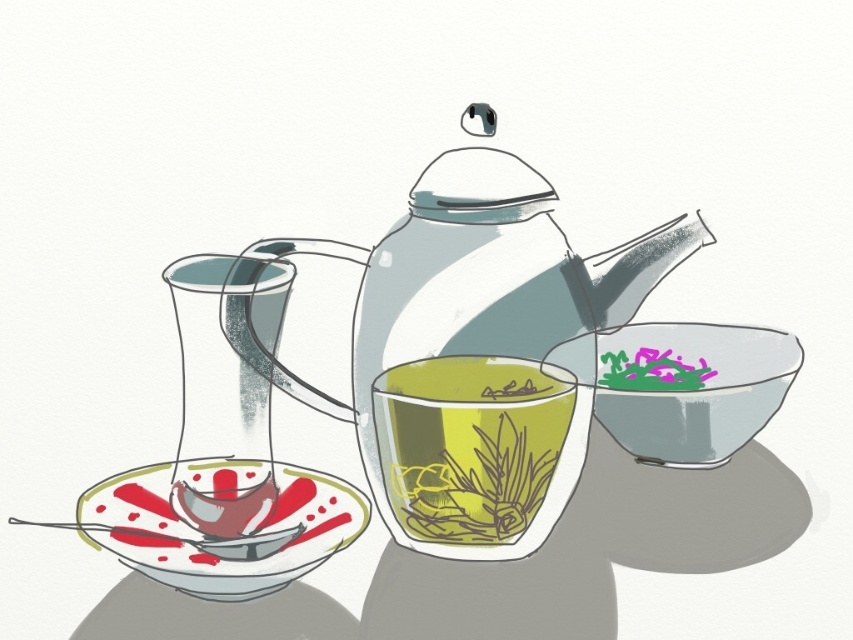
Between point (579, 321) and point (801, 355), which one is positioned in front?

Point (579, 321)

Is translucent glass teapot at center shorter than transparent glass bowl at center right?

Incorrect, translucent glass teapot at center's height does not fall short of transparent glass bowl at center right's.

Image resolution: width=853 pixels, height=640 pixels. What do you see at coordinates (483, 355) in the screenshot?
I see `translucent glass teapot at center` at bounding box center [483, 355].

Locate an element on the screen. The height and width of the screenshot is (640, 853). translucent glass teapot at center is located at coordinates (483, 355).

Is point (311, 509) closer to camera compared to point (759, 428)?

Yes, point (311, 509) is closer to viewer.

Is point (207, 534) positioned after point (642, 417)?

That is False.

Does point (97, 484) lie behind point (711, 365)?

No, (97, 484) is closer to viewer.

You are a GUI agent. You are given a task and a screenshot of the screen. Output one action in this format:
    pyautogui.click(x=<x>, y=<y>)
    Task: Click on the matte glass saucer at lower left
    
    Given the screenshot: What is the action you would take?
    pyautogui.click(x=212, y=531)

Who is taller, translucent glass teapot at center or transparent glass teacup at center?

With more height is translucent glass teapot at center.

Who is more forward, (660,410) or (418,515)?

Point (418,515)

The height and width of the screenshot is (640, 853). I want to click on translucent glass teapot at center, so click(483, 355).